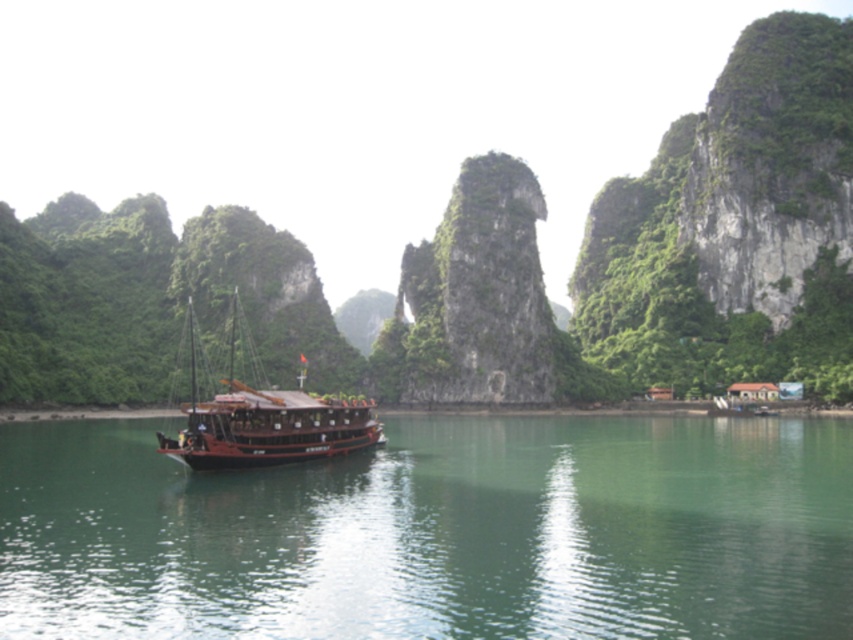
Can you confirm if green smooth water at center is positioned to the left of wooden ship at center?

No, green smooth water at center is not to the left of wooden ship at center.

Between point (354, 497) and point (370, 435), which one is positioned behind?

Point (370, 435)

Where is `green smooth water at center`? green smooth water at center is located at coordinates (436, 532).